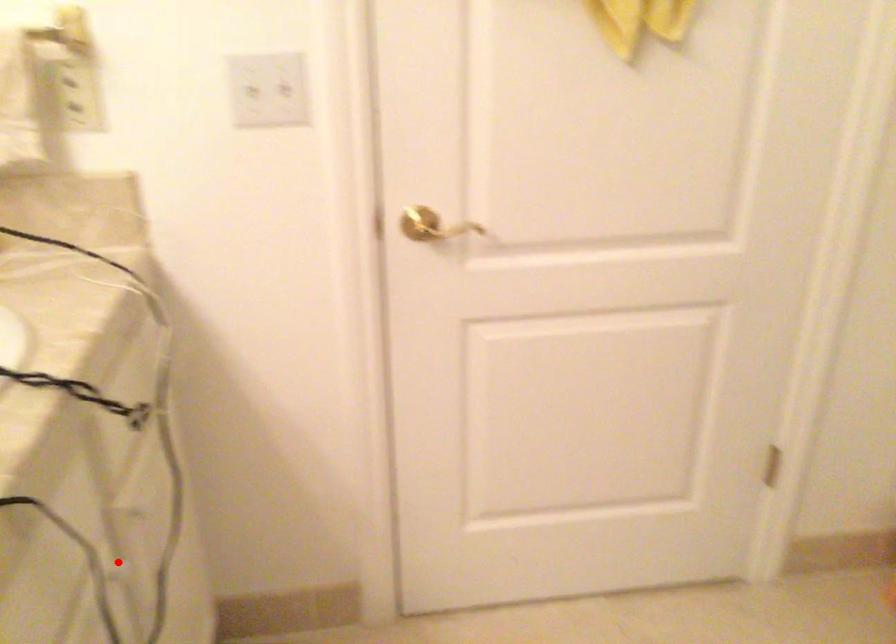
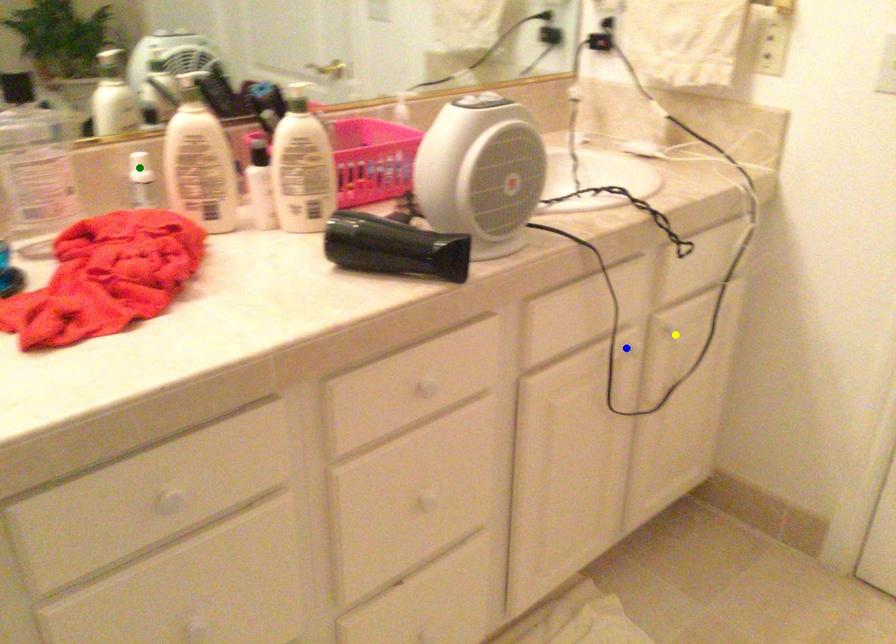
Question: I am providing you with two images of the same scene from different viewpoints. A red point is marked on the first image. You are given multiple points on the second image. Which spot in image 2 lines up with the point in image 1?

Choices:
 (A) yellow point
 (B) green point
 (C) blue point

Answer: (C)